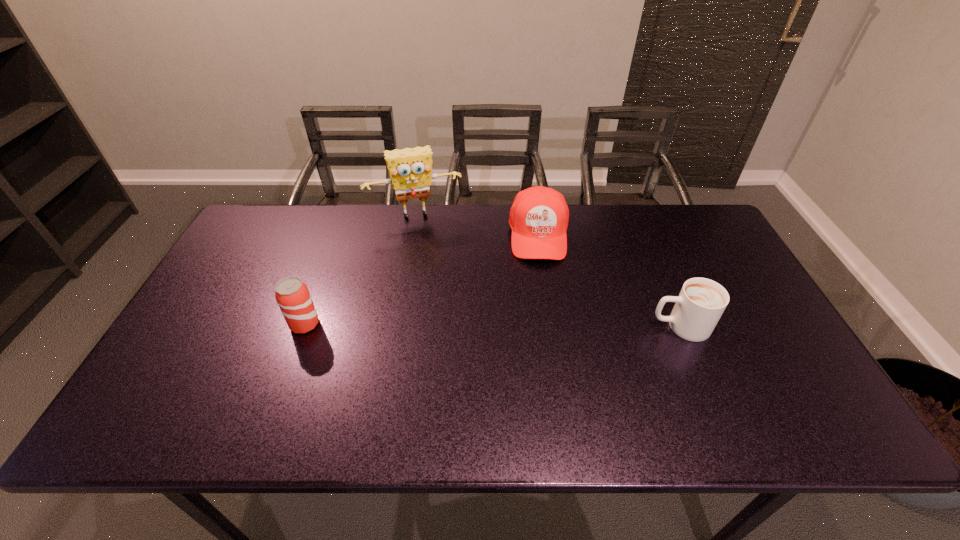
Identify the location of vacant space located 0.160m on the face of the sponge. This screenshot has height=540, width=960. (434, 256).

This screenshot has height=540, width=960. Identify the location of vacant point located on the face of the sponge. (439, 273).

Where is `vacant space located on the front panel of the baseball cap`? The height and width of the screenshot is (540, 960). vacant space located on the front panel of the baseball cap is located at coordinates (545, 348).

Where is `vacant point located on the front panel of the baseball cap`? The width and height of the screenshot is (960, 540). vacant point located on the front panel of the baseball cap is located at coordinates (543, 312).

Image resolution: width=960 pixels, height=540 pixels. I want to click on free point located on the front panel of the baseball cap, so click(546, 372).

Locate an element on the screen. sponge at the far edge is located at coordinates (410, 169).

Find the location of `baseball cap positioned at the far edge`. baseball cap positioned at the far edge is located at coordinates (539, 216).

This screenshot has height=540, width=960. Find the location of `vacant space at the far edge of the desktop`. vacant space at the far edge of the desktop is located at coordinates (616, 244).

This screenshot has height=540, width=960. Find the location of `vacant space at the near edge`. vacant space at the near edge is located at coordinates (519, 381).

In the image, there is a desktop. Where is `blank space at the left edge`? This screenshot has height=540, width=960. blank space at the left edge is located at coordinates (234, 280).